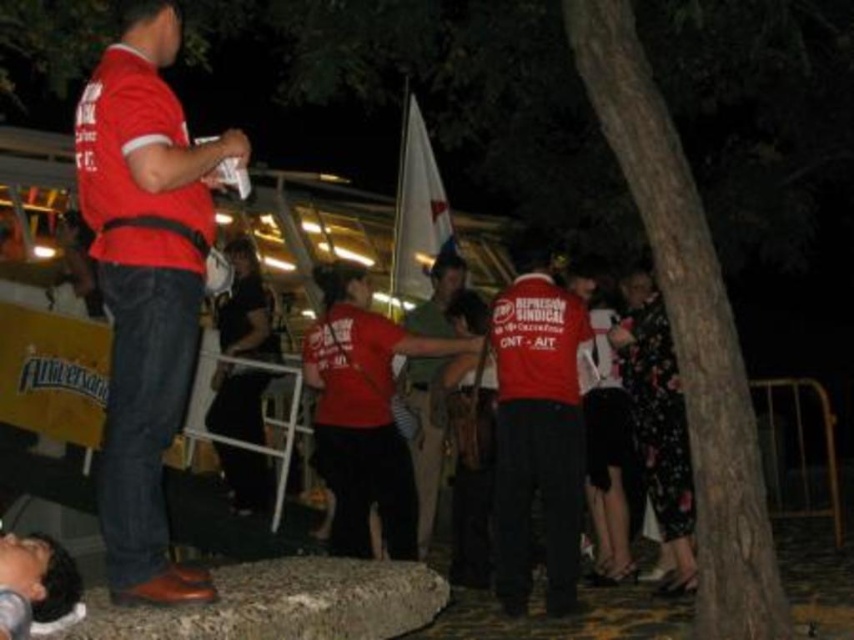
Between matte red shirt at left and matte red shirt at center, which one has less height?

With less height is matte red shirt at left.

Does matte red shirt at left have a greater width compared to matte red shirt at center?

No.

Where is `matte red shirt at left`? The width and height of the screenshot is (854, 640). matte red shirt at left is located at coordinates (145, 284).